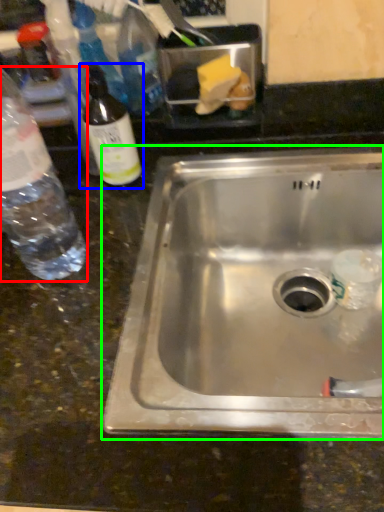
Question: Considering the real-world distances, which object is closest to bottle (highlighted by a red box)? bottle (highlighted by a blue box) or sink (highlighted by a green box).

Choices:
 (A) bottle
 (B) sink

Answer: (A)